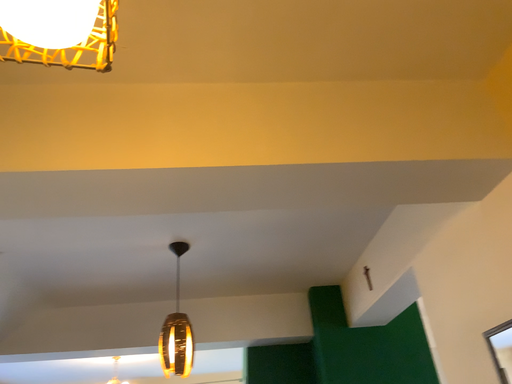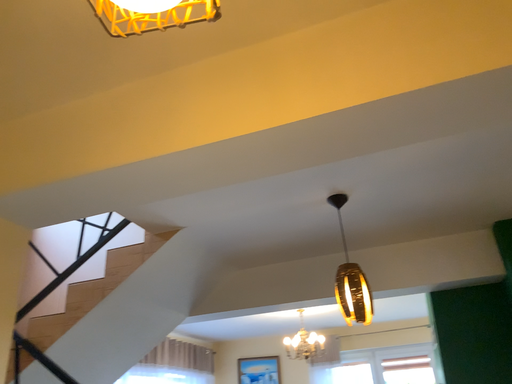
Question: How did the camera likely rotate when shooting the video?

Choices:
 (A) rotated downward
 (B) rotated upward

Answer: (A)